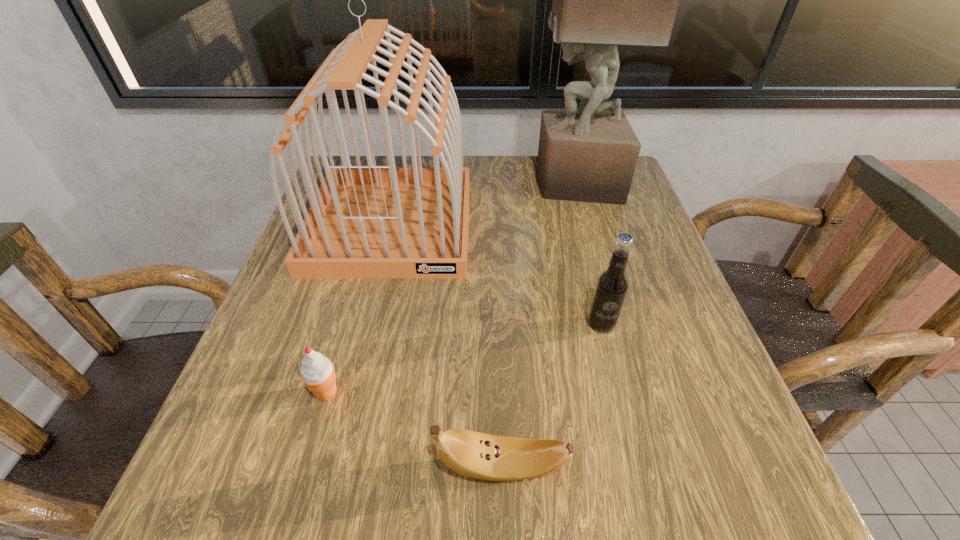
At what (x,y) coordinates should I click in order to perform the action: click on sculpture. Please return your answer as a coordinate pair (x, y). The height and width of the screenshot is (540, 960). Looking at the image, I should click on (600, 0).

Where is `birdcage`? The height and width of the screenshot is (540, 960). birdcage is located at coordinates (371, 221).

At what (x,y) coordinates should I click in order to perform the action: click on the third farthest object. Please return your answer as a coordinate pair (x, y). This screenshot has height=540, width=960. Looking at the image, I should click on (612, 284).

Locate an element on the screen. The image size is (960, 540). the third tallest object is located at coordinates (612, 284).

Where is `the fourth farthest object`? The height and width of the screenshot is (540, 960). the fourth farthest object is located at coordinates (317, 372).

I want to click on banana, so click(x=478, y=455).

Where is `blank area located on the front-facing side of the sculpture`? This screenshot has width=960, height=540. blank area located on the front-facing side of the sculpture is located at coordinates (439, 183).

Where is `vacant area situated 0.100m on the front-facing side of the sculpture`? vacant area situated 0.100m on the front-facing side of the sculpture is located at coordinates (495, 183).

You are a GUI agent. You are given a task and a screenshot of the screen. Output one action in this format:
    pyautogui.click(x=<x>, y=<y>)
    Task: Click on the vacant space located on the front-facing side of the sculpture
    The image size is (960, 540).
    Given the screenshot: What is the action you would take?
    pyautogui.click(x=488, y=183)

Image resolution: width=960 pixels, height=540 pixels. Identify the location of vacant region located 0.180m with an open door on the birdcage. (361, 355).